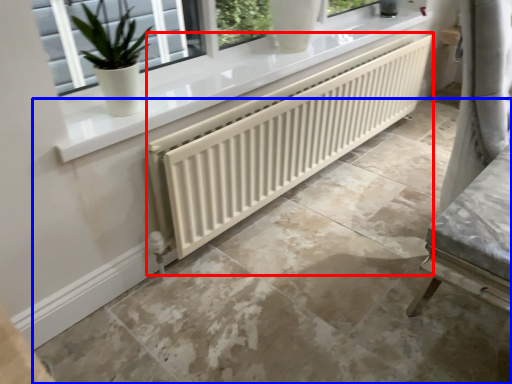
Question: Which object is closer to the camera taking this photo, radiator (highlighted by a red box) or concrete (highlighted by a blue box)?

Choices:
 (A) radiator
 (B) concrete

Answer: (B)